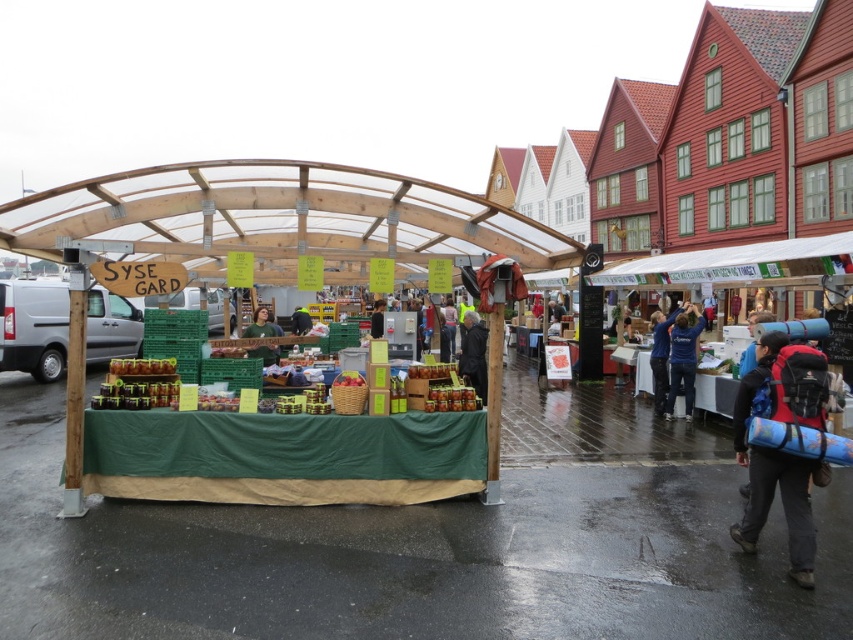
You are a traveler who just arrived at the SYSE GARD market stall. You have a red backpack at right and a blue cotton shirt at center in your view. Which item takes up more horizontal space in the scene?

The blue cotton shirt at center takes up more horizontal space than the red backpack at right because the red backpack at right has a lesser width compared to blue cotton shirt at center.

You are a customer at the SYSE GARD market stall and want to see both the blue cotton shirt at center and the matte black jacket at center. Which item is blocking your view of the other?

The matte black jacket at center is behind the blue cotton shirt at center, so the blue cotton shirt at center is blocking the view of the matte black jacket at center.

Looking at this image, you are a customer at the SYSE GARD market stall and want to purchase both the blue cotton shirt at center and the matte black jacket at center. The cashier has a small counter space that can only accommodate one item at a time. Which item should you place first to ensure both can be processed without overlapping?

The blue cotton shirt at center is wider than the matte black jacket at center. To prevent overlapping, place the wider blue cotton shirt at center first, then the narrower matte black jacket at center next.